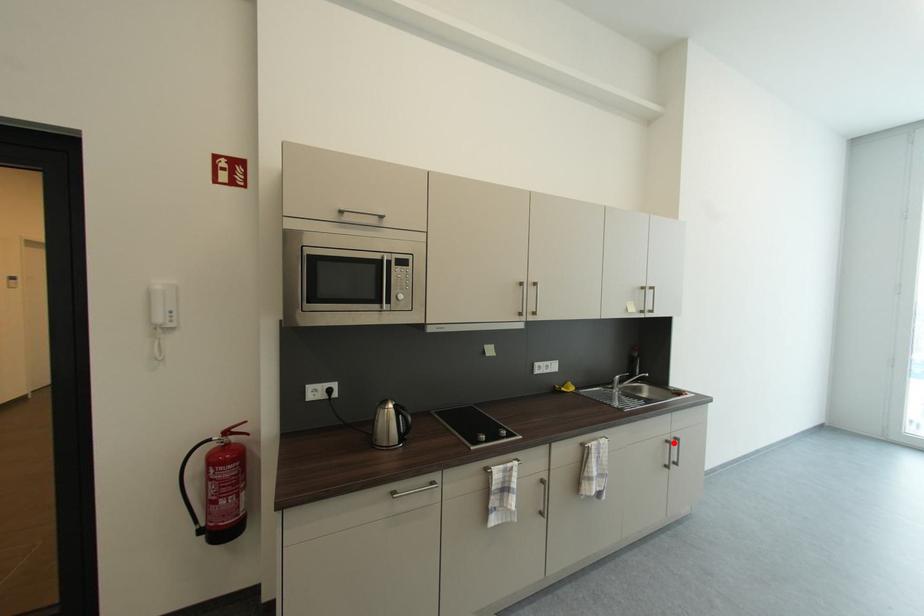
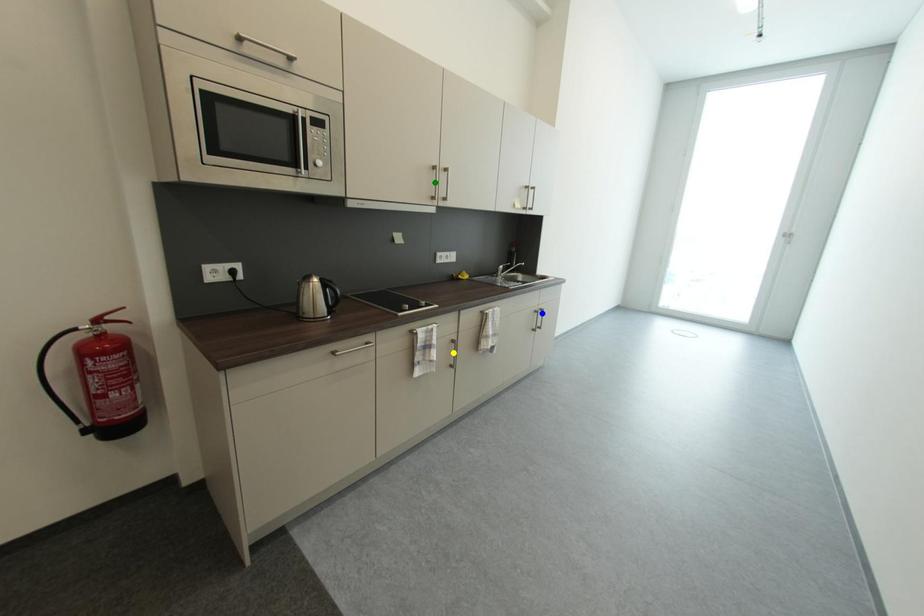
Question: I am providing you with two images of the same scene from different viewpoints. A red point is marked on the first image. You are given multiple points on the second image. Which mark in image 2 goes with the point in image 1?

Choices:
 (A) blue point
 (B) yellow point
 (C) green point

Answer: (A)